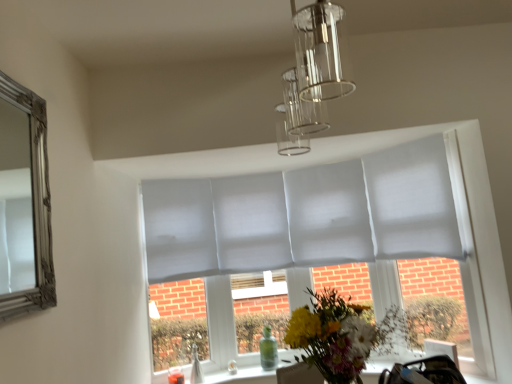
You are a GUI agent. You are given a task and a screenshot of the screen. Output one action in this format:
    pyautogui.click(x=<x>, y=<y>)
    Task: Click on the fluffy bouquet at center
    
    Given the screenshot: What is the action you would take?
    pyautogui.click(x=341, y=335)

In order to face transparent glass vase at lower center, which ranks as the 1th glass vase in back-to-front order, should I rotate leftwards or rightwards?

It's best to rotate right around 1.491 degrees.

Image resolution: width=512 pixels, height=384 pixels. What do you see at coordinates (268, 350) in the screenshot? I see `transparent glass vase at lower center, the 2th glass vase viewed from the left` at bounding box center [268, 350].

Locate an element on the screen. fluffy bouquet at center is located at coordinates (341, 335).

Is clear glass vase at lower center, the 2th glass vase viewed from the right, wider or thinner than clear glass chandelier at upper center?

Clearly, clear glass vase at lower center, the 2th glass vase viewed from the right, has less width compared to clear glass chandelier at upper center.

Would you say clear glass vase at lower center, which ranks as the 1th glass vase in front-to-back order, is inside or outside clear glass chandelier at upper center?

clear glass vase at lower center, which ranks as the 1th glass vase in front-to-back order, is not enclosed by clear glass chandelier at upper center.

Is clear glass vase at lower center, which ranks as the 1th glass vase in front-to-back order, not near clear glass chandelier at upper center?

clear glass vase at lower center, which ranks as the 1th glass vase in front-to-back order, is positioned a significant distance from clear glass chandelier at upper center.

Does clear glass vase at lower center, which ranks as the 1th glass vase in front-to-back order, appear on the left side of clear glass chandelier at upper center?

Yes.

Is clear glass vase at lower center, the 2th glass vase viewed from the right, at the back of clear glass chandelier at upper center?

That's not correct — clear glass chandelier at upper center is not looking away from clear glass vase at lower center, the 2th glass vase viewed from the right.

Is clear glass chandelier at upper center taller or shorter than clear glass vase at lower center, marked as the second glass vase in a back-to-front arrangement?

Considering their sizes, clear glass chandelier at upper center has more height than clear glass vase at lower center, marked as the second glass vase in a back-to-front arrangement.

Is clear glass chandelier at upper center positioned in front of clear glass vase at lower center, arranged as the 1th glass vase when viewed from the left?

Yes, clear glass chandelier at upper center is in front of clear glass vase at lower center, arranged as the 1th glass vase when viewed from the left.

Is clear glass chandelier at upper center positioned with its back to transparent glass vase at lower center, arranged as the 2th glass vase when viewed from the front?

clear glass chandelier at upper center does not have its back to transparent glass vase at lower center, arranged as the 2th glass vase when viewed from the front.

Is clear glass chandelier at upper center positioned behind transparent glass vase at lower center, which is the 1th glass vase in right-to-left order?

No, clear glass chandelier at upper center is closer to the viewer.

Between clear glass chandelier at upper center and transparent glass vase at lower center, which ranks as the 1th glass vase in back-to-front order, which one has smaller size?

transparent glass vase at lower center, which ranks as the 1th glass vase in back-to-front order, is smaller.

From the image's perspective, which one is positioned higher, fluffy bouquet at center or clear glass vase at lower center, the 2th glass vase viewed from the right?

fluffy bouquet at center is shown above in the image.

Considering the relative sizes of fluffy bouquet at center and clear glass vase at lower center, which ranks as the 1th glass vase in front-to-back order, in the image provided, is fluffy bouquet at center taller than clear glass vase at lower center, which ranks as the 1th glass vase in front-to-back order,?

Yes.

Which point is more forward, (306, 359) or (191, 353)?

The point (306, 359) is more forward.

Between fluffy bouquet at center and clear glass vase at lower center, which ranks as the 1th glass vase in front-to-back order, which one has larger size?

fluffy bouquet at center is bigger.

Can you tell me how much fluffy bouquet at center and transparent glass vase at lower center, which is the 1th glass vase in right-to-left order, differ in facing direction?

There is a 85.7-degree angle between the facing directions of fluffy bouquet at center and transparent glass vase at lower center, which is the 1th glass vase in right-to-left order.

Does fluffy bouquet at center have a greater height compared to transparent glass vase at lower center, which is the 1th glass vase in right-to-left order?

Yes.

Identify the location of the 1st glass vase counting from the left of the fluffy bouquet at center. (268, 350).

Which is more to the right, transparent glass vase at lower center, the 2th glass vase viewed from the left, or clear glass chandelier at upper center?

Positioned to the right is clear glass chandelier at upper center.

Identify the location of light fixture that appears in front of the transparent glass vase at lower center, which is the 1th glass vase in right-to-left order. The width and height of the screenshot is (512, 384). (313, 75).

Which is in front, transparent glass vase at lower center, arranged as the 2th glass vase when viewed from the front, or clear glass chandelier at upper center?

clear glass chandelier at upper center is in front.

How many degrees apart are the facing directions of transparent glass vase at lower center, arranged as the 2th glass vase when viewed from the front, and clear glass chandelier at upper center?

transparent glass vase at lower center, arranged as the 2th glass vase when viewed from the front, and clear glass chandelier at upper center are facing 90.5 degrees away from each other.

Is clear glass chandelier at upper center aimed at fluffy bouquet at center?

No.

What are the coordinates of `light fixture that is above the fluffy bouquet at center (from a real-world perspective)` in the screenshot? It's located at (313, 75).

Between clear glass chandelier at upper center and fluffy bouquet at center, which one has larger size?

With larger size is clear glass chandelier at upper center.

From the picture: Is clear glass chandelier at upper center situated inside fluffy bouquet at center or outside?

The correct answer is: outside.

Identify the location of glass vase that is the 2nd object located below the clear glass chandelier at upper center (from the image's perspective). (196, 367).

You are a GUI agent. You are given a task and a screenshot of the screen. Output one action in this format:
    pyautogui.click(x=<x>, y=<y>)
    Task: Click on the 1st glass vase behind the clear glass chandelier at upper center
    This screenshot has width=512, height=384.
    Given the screenshot: What is the action you would take?
    pyautogui.click(x=196, y=367)

From the image, which object appears to be nearer to clear glass vase at lower center, arranged as the 1th glass vase when viewed from the left, clear glass chandelier at upper center or transparent glass vase at lower center, the 2th glass vase viewed from the left?

The object closer to clear glass vase at lower center, arranged as the 1th glass vase when viewed from the left, is transparent glass vase at lower center, the 2th glass vase viewed from the left.

Based on their spatial positions, is clear glass vase at lower center, arranged as the 1th glass vase when viewed from the left, or fluffy bouquet at center further from transparent glass vase at lower center, which is the 1th glass vase in right-to-left order?

fluffy bouquet at center.

Based on their spatial positions, is clear glass chandelier at upper center or transparent glass vase at lower center, the 2th glass vase viewed from the left, further from fluffy bouquet at center?

Among the two, transparent glass vase at lower center, the 2th glass vase viewed from the left, is located further to fluffy bouquet at center.

Looking at the image, which one is located closer to clear glass vase at lower center, the 2th glass vase viewed from the right, fluffy bouquet at center or transparent glass vase at lower center, the 2th glass vase viewed from the left?

transparent glass vase at lower center, the 2th glass vase viewed from the left, is positioned closer to the anchor clear glass vase at lower center, the 2th glass vase viewed from the right.

Which object lies nearer to the anchor point transparent glass vase at lower center, arranged as the 2th glass vase when viewed from the front, clear glass chandelier at upper center or fluffy bouquet at center?

Among the two, fluffy bouquet at center is located nearer to transparent glass vase at lower center, arranged as the 2th glass vase when viewed from the front.

Looking at the image, which one is located closer to fluffy bouquet at center, transparent glass vase at lower center, arranged as the 2th glass vase when viewed from the front, or clear glass vase at lower center, which ranks as the 1th glass vase in front-to-back order?

Based on the image, transparent glass vase at lower center, arranged as the 2th glass vase when viewed from the front, appears to be nearer to fluffy bouquet at center.

Looking at the image, which one is located further to fluffy bouquet at center, transparent glass vase at lower center, arranged as the 2th glass vase when viewed from the front, or clear glass chandelier at upper center?

transparent glass vase at lower center, arranged as the 2th glass vase when viewed from the front, is further to fluffy bouquet at center.

Estimate the real-world distances between objects in this image. Which object is further from clear glass chandelier at upper center, clear glass vase at lower center, which ranks as the 1th glass vase in front-to-back order, or fluffy bouquet at center?

Based on the image, clear glass vase at lower center, which ranks as the 1th glass vase in front-to-back order, appears to be further to clear glass chandelier at upper center.

Where is `glass vase positioned between clear glass chandelier at upper center and transparent glass vase at lower center, the 2th glass vase viewed from the left, from near to far`? This screenshot has width=512, height=384. glass vase positioned between clear glass chandelier at upper center and transparent glass vase at lower center, the 2th glass vase viewed from the left, from near to far is located at coordinates (196, 367).

This screenshot has width=512, height=384. I want to click on flower located between clear glass chandelier at upper center and transparent glass vase at lower center, which ranks as the 1th glass vase in back-to-front order, in the depth direction, so click(x=341, y=335).

The width and height of the screenshot is (512, 384). What are the coordinates of `glass vase between fluffy bouquet at center and transparent glass vase at lower center, arranged as the 2th glass vase when viewed from the front, in the front-back direction` in the screenshot? It's located at (196, 367).

The width and height of the screenshot is (512, 384). Find the location of `flower between clear glass chandelier at upper center and clear glass vase at lower center, arranged as the 1th glass vase when viewed from the left, along the z-axis`. flower between clear glass chandelier at upper center and clear glass vase at lower center, arranged as the 1th glass vase when viewed from the left, along the z-axis is located at coordinates (341, 335).